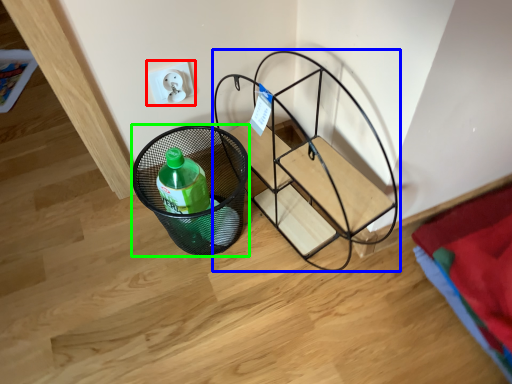
Question: Which object is positioned farthest from electric outlet (highlighted by a red box)? Select from furniture (highlighted by a blue box) and basket (highlighted by a green box).

Choices:
 (A) furniture
 (B) basket

Answer: (A)